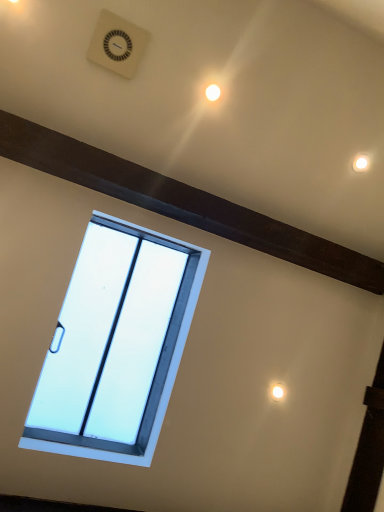
Question: Is point (89, 440) closer or farther from the camera than point (215, 91)?

Choices:
 (A) closer
 (B) farther

Answer: (B)

Question: Based on their sizes in the image, would you say white plastic window at center is bigger or smaller than white glossy light at upper center?

Choices:
 (A) big
 (B) small

Answer: (A)

Question: Estimate the real-world distances between objects in this image. Which object is farther from the white plastic window at center?

Choices:
 (A) white plastic clock at upper center
 (B) white glossy light at upper center

Answer: (B)

Question: Which object is positioned closest to the white glossy light at upper center?

Choices:
 (A) white plastic clock at upper center
 (B) white plastic window at center

Answer: (A)